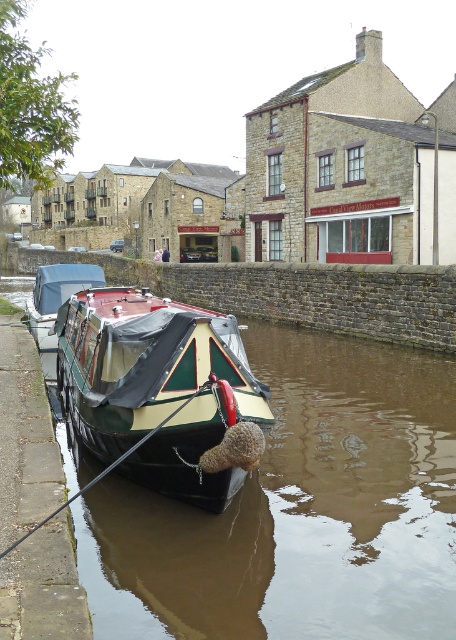
Question: Where is green matte boat at center located in relation to green polished wood boat at center in the image?

Choices:
 (A) right
 (B) left

Answer: (B)

Question: Among these points, which one is farthest from the camera?

Choices:
 (A) (167, 540)
 (B) (88, 400)
 (C) (98, 476)

Answer: (C)

Question: Which object is the closest to the green polished wood boat at center?

Choices:
 (A) green painted wood boat at center
 (B) green matte boat at center

Answer: (B)

Question: Which point is farther to the camera?

Choices:
 (A) (232, 540)
 (B) (17, 541)
 (C) (169, 374)

Answer: (A)

Question: Can you confirm if green matte boat at center is positioned to the left of green polished wood boat at center?

Choices:
 (A) no
 (B) yes

Answer: (B)

Question: In this image, where is green painted wood boat at center located relative to green matte boat at center?

Choices:
 (A) above
 (B) below

Answer: (B)